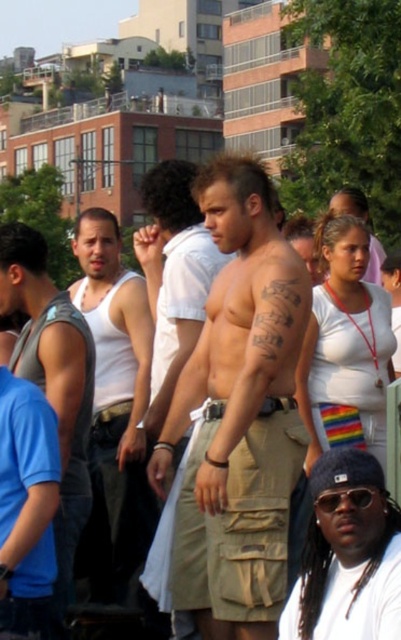
Looking at this image, you are standing at the camera position and want to pick up the black knit cap at lower right. Can you reach it without moving your feet?

The black knit cap at lower right is 70.15 feet away from the camera, so you cannot reach it without moving your feet.

From the picture: Based on the scene description, where is the white matte tank top at center located in the image?

The white matte tank top at center is located at point 0.637 in the x coordinate and 0.287 in the y coordinate.

You are a photographer at this event and want to take a photo focusing on the black knit cap at lower right and tan cargo shorts at center. Which object will appear larger in the photo?

The black knit cap at lower right is closer to the viewer than the tan cargo shorts at center, so it will appear larger in the photo.